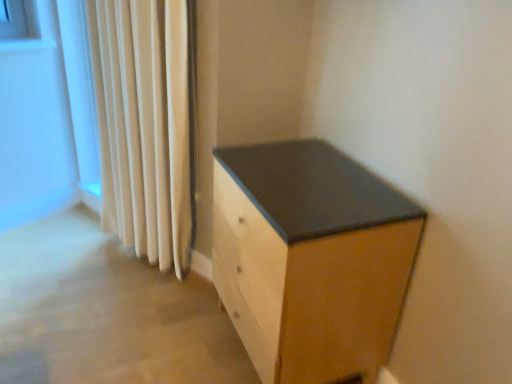
Where is `free location to the left of beige fabric curtain at left`? Image resolution: width=512 pixels, height=384 pixels. free location to the left of beige fabric curtain at left is located at coordinates (101, 271).